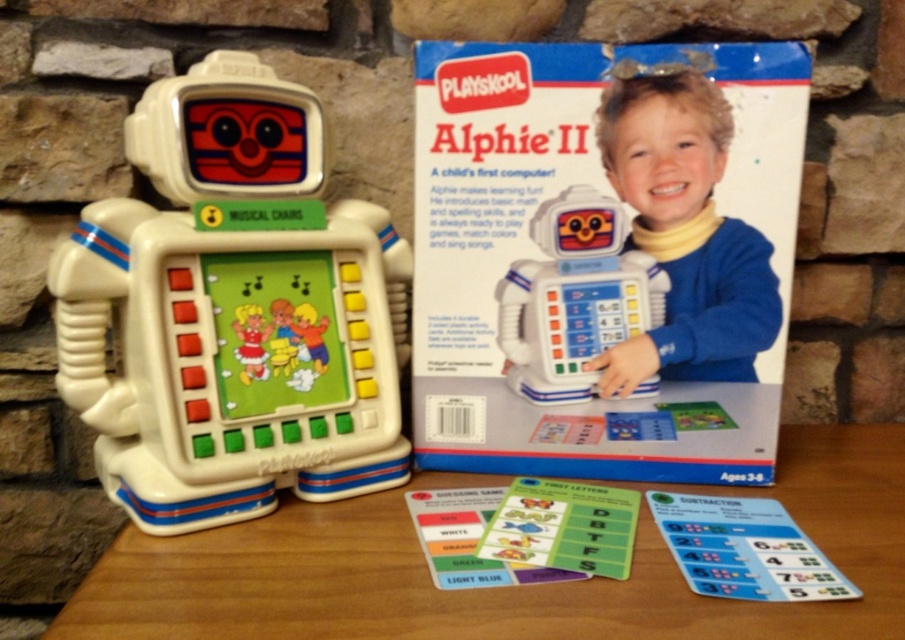
Who is more distant from viewer, (x=721, y=570) or (x=537, y=211)?

Positioned behind is point (x=537, y=211).

Can you confirm if cardboard cards at lower center is positioned to the right of white plastic robot at center?

Correct, you'll find cardboard cards at lower center to the right of white plastic robot at center.

Between point (818, 580) and point (615, 339), which one is positioned in front?

Point (818, 580)

Image resolution: width=905 pixels, height=640 pixels. What are the coordinates of `cardboard cards at lower center` in the screenshot? It's located at point(522,532).

Can you confirm if white plastic robot at left is positioned to the left of white plastic robot at center?

Indeed, white plastic robot at left is positioned on the left side of white plastic robot at center.

Does white plastic robot at left appear under white plastic robot at center?

No.

This screenshot has height=640, width=905. I want to click on white plastic robot at left, so click(233, 310).

At what (x,y) coordinates should I click in order to perform the action: click on white plastic robot at left. Please return your answer as a coordinate pair (x, y). This screenshot has width=905, height=640. Looking at the image, I should click on (233, 310).

Can you confirm if yellow turtleneck sweater at upper center is positioned above cardboard cards at lower center?

Correct, yellow turtleneck sweater at upper center is located above cardboard cards at lower center.

Is the position of yellow turtleneck sweater at upper center more distant than that of cardboard cards at lower center?

Yes, it is behind cardboard cards at lower center.

Who is more distant from viewer, (612, 346) or (702, 545)?

The point (612, 346) is behind.

Locate an element on the screen. The height and width of the screenshot is (640, 905). yellow turtleneck sweater at upper center is located at coordinates (684, 234).